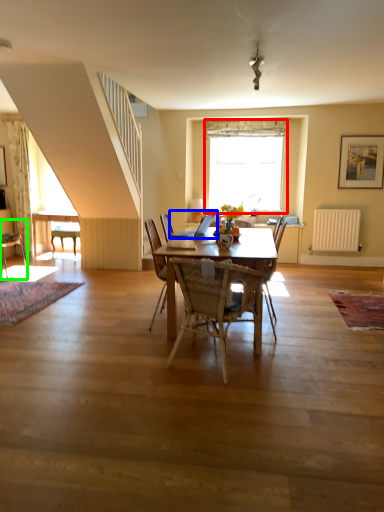
Question: Which object is the farthest from window (highlighted by a red box)? Choose among these: laptop (highlighted by a blue box) or chair (highlighted by a green box).

Choices:
 (A) laptop
 (B) chair

Answer: (B)